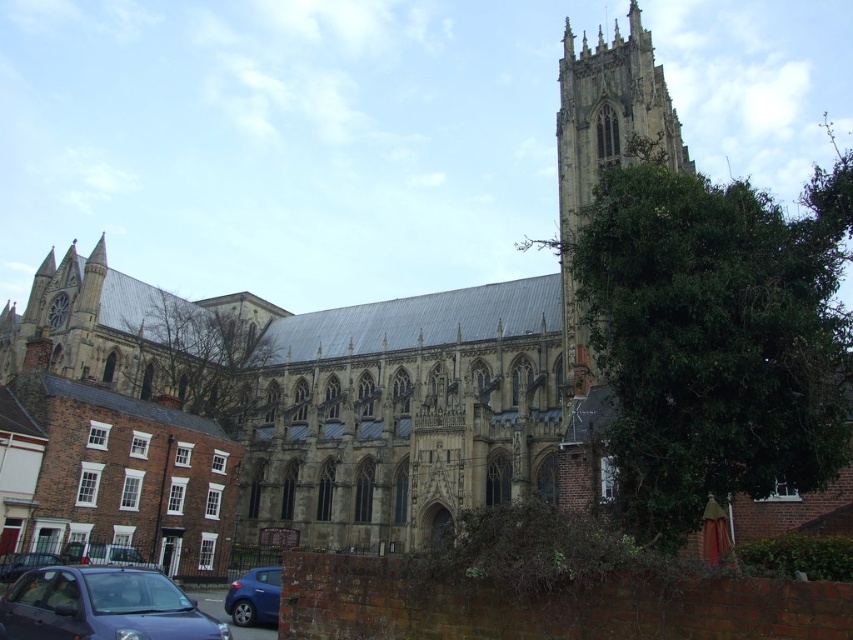
You are standing in front of the cathedral and want to take a photo that includes both the green leafy tree at right and the metallic blue car at lower left. Which object should you zoom in on more to fit both into the frame?

Since the green leafy tree at right is bigger than the metallic blue car at lower left, you should zoom in more on the tree to ensure both objects are visible in the photo.

You are standing in front of the cathedral and want to take a photo that includes the smooth stone tower at upper right. Where should you position yourself relative to the cathedral to ensure the tower is in the frame?

To include the smooth stone tower at upper right in your photo, position yourself on the left side of the cathedral so that the tower at upper right is visible in the frame.

You are standing at the point closest to the cathedral. Which point is closer to you, point [561,112] or point [215,332]?

Point [561,112] is in front of point [215,332], so it is closer to you.